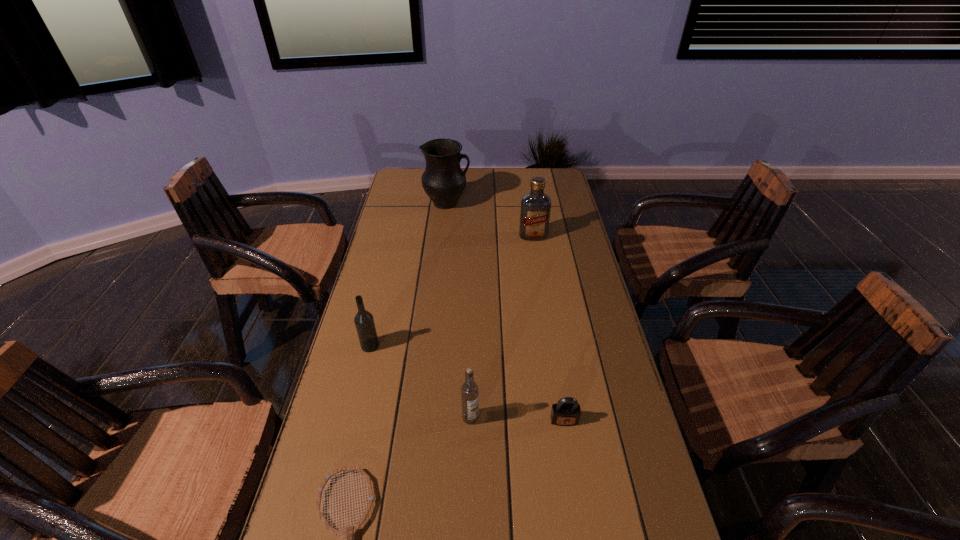
Find the location of a particular element. Image resolution: width=960 pixels, height=540 pixels. the farthest object is located at coordinates (443, 180).

Where is `the farthest vodka`? This screenshot has height=540, width=960. the farthest vodka is located at coordinates (535, 210).

The width and height of the screenshot is (960, 540). Identify the location of the tallest vodka. (535, 210).

Image resolution: width=960 pixels, height=540 pixels. In order to click on the second vodka from left to right in this screenshot , I will do `click(469, 390)`.

The width and height of the screenshot is (960, 540). What are the coordinates of `the fourth nearest object` in the screenshot? It's located at (364, 322).

Image resolution: width=960 pixels, height=540 pixels. Find the location of `the second farthest vodka`. the second farthest vodka is located at coordinates (364, 322).

I want to click on the fifth tallest object, so click(566, 412).

Identify the location of vacant space situated 0.310m on the handle side of the pitcher. (546, 203).

This screenshot has width=960, height=540. Identify the location of vacant space located on the front-facing side of the tallest vodka. (541, 292).

Identify the location of vacant area located 0.210m on the label of the second vodka from left to right. (468, 519).